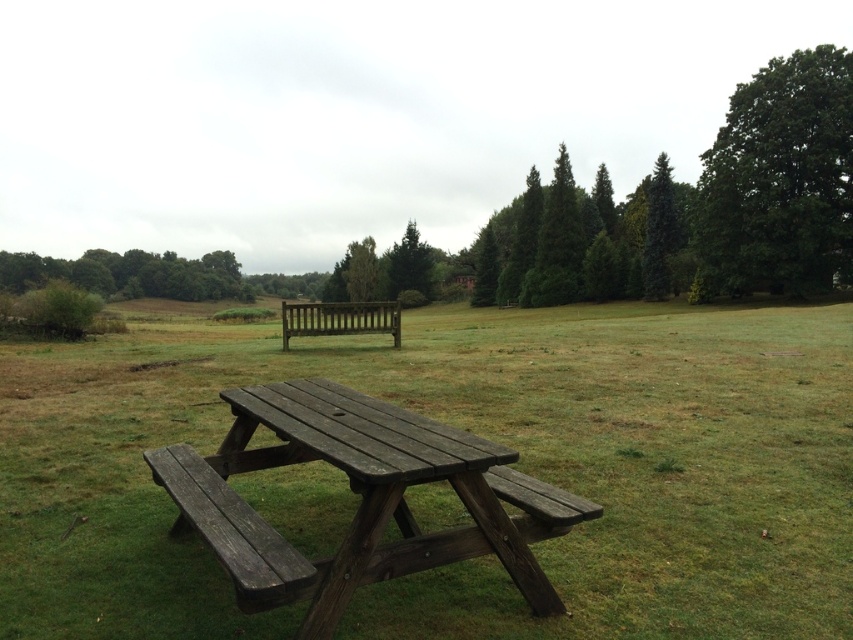
You are planning to set up a small garden near the brown wooden picnic table at center and the green leafy tree at upper right. Considering their sizes, which object would require more space for the garden to be placed around it?

The green leafy tree at upper right requires more space for the garden to be placed around it because it is larger than the brown wooden picnic table at center.

You are planning to set up a small tent between the brown wooden picnic table at center and the wooden bench at center. Based on their positions, which side of the picnic table should you place the tent on to ensure it is closer to the bench?

The brown wooden picnic table at center is to the right of the wooden bench at center, so placing the tent to the left side of the picnic table would position it closer to the bench.